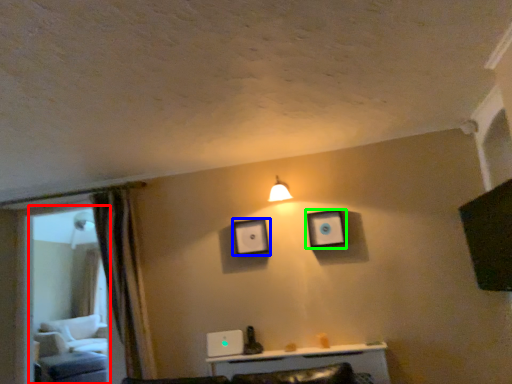
Question: Considering the real-world distances, which object is closest to glass door (highlighted by a red box)? picture frame (highlighted by a blue box) or picture frame (highlighted by a green box).

Choices:
 (A) picture frame
 (B) picture frame

Answer: (A)